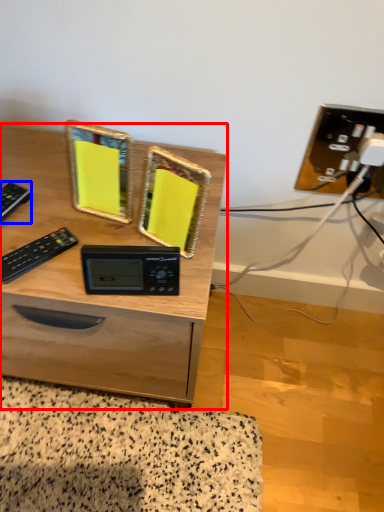
Question: Which object is further to the camera taking this photo, desk (highlighted by a red box) or control (highlighted by a blue box)?

Choices:
 (A) desk
 (B) control

Answer: (B)